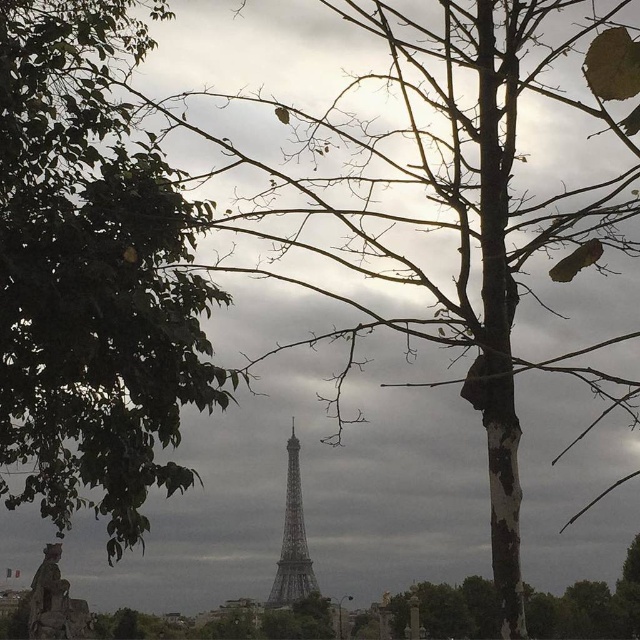
You are standing at the base of the metallic gray Eiffel Tower at center and want to walk to the green leafy tree at left. Given that the average walking speed is 3 miles per hour, how long would it take you to reach the tree?

The distance between the green leafy tree at left and the metallic gray Eiffel Tower at center is 281.61 feet. Converting this distance to miles, 281.61 feet is approximately 0.053 miles. At an average walking speed of 3 miles per hour, the time required would be distance divided by speed, which is 0.053 miles divided by 3 mph, resulting in approximately 0.0177 hours. Converting hours to minutes by multiplying by 60, this equals roughly 1.06 minutes. Therefore, it would take approximately 1 minute to reach.

You are standing in front of the Eiffel Tower and want to take a photo that includes both the green leafy tree at left and the metallic gray Eiffel Tower at center. Based on their widths, which object should you position closer to the edge of the frame to ensure both fit in the photo?

The green leafy tree at left might be wider than the metallic gray Eiffel Tower at center, so to ensure both fit in the photo, position the wider green leafy tree at left closer to the edge of the frame.

You are standing at the base of the Eiffel Tower and want to take a photo of the green leafy tree at left from your current position. Given that the distance between you and the tree is 632.25 meters, will you be able to capture the entire tree in your camera frame without moving? Explain your answer based on typical camera lens capabilities.

The distance between you and the green leafy tree at left is 632.25 meters. Most standard camera lenses have a field of view that can capture objects at such distances, but capturing the entire tree would depend on the tree height and lens focal length. However, since the question specifies not moving and using typical lenses, it might be challenging to fit the entire tree in frame due to the vast distance unless using a wide angle lens.